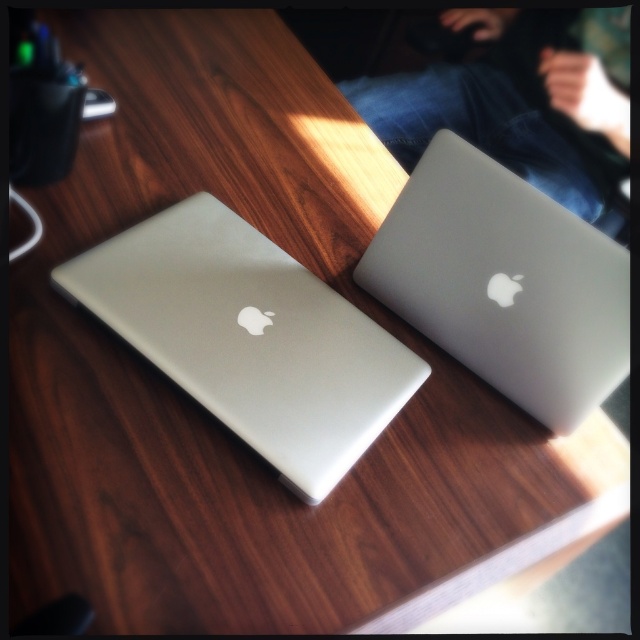
Looking at this image, does sleek silver laptop at center have a smaller size compared to satin silver laptop at upper right?

Incorrect, sleek silver laptop at center is not smaller in size than satin silver laptop at upper right.

Which is behind, point (193, 257) or point (419, 241)?

The point (419, 241) is behind.

At what (x,y) coordinates should I click in order to perform the action: click on sleek silver laptop at center. Please return your answer as a coordinate pair (x, y). Image resolution: width=640 pixels, height=640 pixels. Looking at the image, I should click on (248, 337).